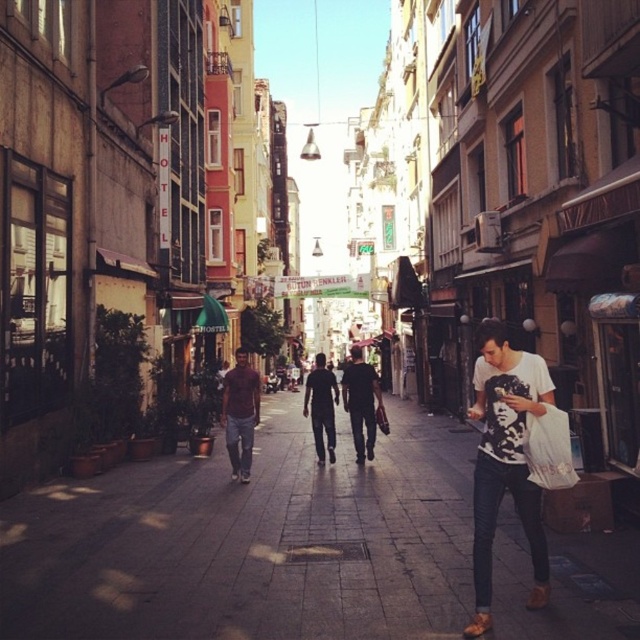
Who is positioned more to the right, white printed t-shirt at center-right or dark gray fabric jacket at center?

white printed t-shirt at center-right

Between point (502, 476) and point (358, 420), which one is positioned behind?

Positioned behind is point (358, 420).

Does point (534, 513) come farther from viewer compared to point (376, 394)?

No.

This screenshot has height=640, width=640. Find the location of `white printed t-shirt at center-right`. white printed t-shirt at center-right is located at coordinates (506, 460).

Between dark gray fabric jacket at center and dark blue jeans at center, which one is positioned lower?

dark blue jeans at center is lower down.

Does point (355, 360) lie behind point (323, 390)?

Yes, it is behind point (323, 390).

At what (x,y) coordinates should I click in order to perform the action: click on dark gray fabric jacket at center. Please return your answer as a coordinate pair (x, y). Looking at the image, I should click on (360, 403).

Looking at this image, between matte brown shirt at center and dark gray fabric jacket at center, which one appears on the right side from the viewer's perspective?

dark gray fabric jacket at center

This screenshot has height=640, width=640. Describe the element at coordinates (241, 413) in the screenshot. I see `matte brown shirt at center` at that location.

This screenshot has width=640, height=640. I want to click on matte brown shirt at center, so click(x=241, y=413).